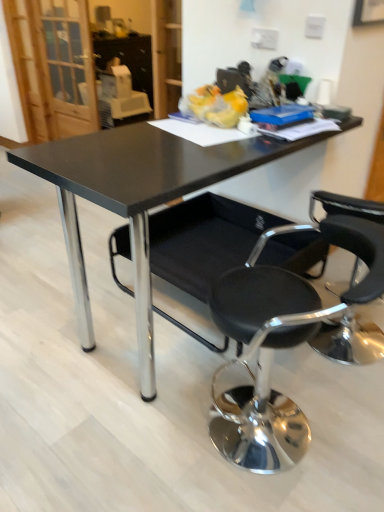
Locate an element on the screen. Image resolution: width=384 pixels, height=512 pixels. black glossy table at center is located at coordinates (135, 199).

Measure the distance between black fabric chair at center, the second chair viewed from the front, and camera.

A distance of 1.95 meters exists between black fabric chair at center, the second chair viewed from the front, and camera.

The height and width of the screenshot is (512, 384). What do you see at coordinates (204, 240) in the screenshot?
I see `black fabric chair at center, the second chair viewed from the front` at bounding box center [204, 240].

What is the approximate width of black leather chair at lower right, which is the first chair from front to back?

The width of black leather chair at lower right, which is the first chair from front to back, is 20.86 inches.

The width and height of the screenshot is (384, 512). In order to click on black glossy table at center in this screenshot , I will do `click(135, 199)`.

Is black fabric chair at center, the second chair viewed from the front, behind black glossy table at center?

Yes.

Considering the sizes of objects black fabric chair at center, which is counted as the 1th chair, starting from the back, and black glossy table at center in the image provided, who is shorter, black fabric chair at center, which is counted as the 1th chair, starting from the back, or black glossy table at center?

With less height is black fabric chair at center, which is counted as the 1th chair, starting from the back.

Is black fabric chair at center, which is counted as the 1th chair, starting from the back, directly adjacent to black glossy table at center?

No, black fabric chair at center, which is counted as the 1th chair, starting from the back, is not with black glossy table at center.

Could you tell me if black leather chair at lower right, which is the first chair from front to back, is facing black glossy table at center?

Yes, black leather chair at lower right, which is the first chair from front to back, is oriented towards black glossy table at center.

How many degrees apart are the facing directions of black leather chair at lower right, which is counted as the 2th chair, starting from the back, and black glossy table at center?

The angular difference between black leather chair at lower right, which is counted as the 2th chair, starting from the back, and black glossy table at center is 33.2 degrees.

From a real-world perspective, between black leather chair at lower right, which is counted as the 2th chair, starting from the back, and black glossy table at center, who is vertically higher?

In real-world perspective, black glossy table at center is above.

Is point (245, 308) positioned before point (46, 150)?

No, (245, 308) is further to viewer.

Is black leather chair at lower right, which is counted as the 2th chair, starting from the back, aimed at black fabric chair at center, which is counted as the 1th chair, starting from the back?

No, black leather chair at lower right, which is counted as the 2th chair, starting from the back, is not aimed at black fabric chair at center, which is counted as the 1th chair, starting from the back.

Which of these two, black leather chair at lower right, which is counted as the 2th chair, starting from the back, or black fabric chair at center, the second chair viewed from the front, is bigger?

black fabric chair at center, the second chair viewed from the front, is bigger.

Is black leather chair at lower right, which is the first chair from front to back, inside the boundaries of black fabric chair at center, which is counted as the 1th chair, starting from the back, or outside?

black leather chair at lower right, which is the first chair from front to back, exists outside the volume of black fabric chair at center, which is counted as the 1th chair, starting from the back.

Does black leather chair at lower right, which is the first chair from front to back, appear on the left side of black fabric chair at center, which is counted as the 1th chair, starting from the back?

In fact, black leather chair at lower right, which is the first chair from front to back, is to the right of black fabric chair at center, which is counted as the 1th chair, starting from the back.

How many degrees apart are the facing directions of black glossy table at center and black fabric chair at center, the second chair viewed from the front?

The angular difference between black glossy table at center and black fabric chair at center, the second chair viewed from the front, is 0.00056 degrees.

What are the coordinates of `table in front of the black fabric chair at center, the second chair viewed from the front` in the screenshot? It's located at (135, 199).

Based on the photo, from a real-world perspective, which is physically above, black glossy table at center or black fabric chair at center, the second chair viewed from the front?

In real-world perspective, black glossy table at center is above.

Is black glossy table at center next to black fabric chair at center, which is counted as the 1th chair, starting from the back?

They are not placed beside each other.

Is black fabric chair at center, the second chair viewed from the front, not near black leather chair at lower right, which is the first chair from front to back?

No, black fabric chair at center, the second chair viewed from the front, is in close proximity to black leather chair at lower right, which is the first chair from front to back.

Which object is closer to the camera, black fabric chair at center, which is counted as the 1th chair, starting from the back, or black leather chair at lower right, which is counted as the 2th chair, starting from the back?

black leather chair at lower right, which is counted as the 2th chair, starting from the back, is closer to the camera.

Identify the location of chair in front of the black fabric chair at center, which is counted as the 1th chair, starting from the back. The width and height of the screenshot is (384, 512). (288, 345).

From the image's perspective, relative to black leather chair at lower right, which is the first chair from front to back, is black fabric chair at center, which is counted as the 1th chair, starting from the back, above or below?

black fabric chair at center, which is counted as the 1th chair, starting from the back, is situated higher than black leather chair at lower right, which is the first chair from front to back, in the image.

Looking at this image, from a real-world perspective, is black glossy table at center positioned over black leather chair at lower right, which is the first chair from front to back, based on gravity?

Yes.

Would you say black glossy table at center is a long distance from black leather chair at lower right, which is counted as the 2th chair, starting from the back?

No, black glossy table at center is not far away from black leather chair at lower right, which is counted as the 2th chair, starting from the back.

Does black glossy table at center have a lesser width compared to black leather chair at lower right, which is the first chair from front to back?

No, black glossy table at center is not thinner than black leather chair at lower right, which is the first chair from front to back.

Can you confirm if black glossy table at center is smaller than black leather chair at lower right, which is counted as the 2th chair, starting from the back?

No, black glossy table at center is not smaller than black leather chair at lower right, which is counted as the 2th chair, starting from the back.

This screenshot has width=384, height=512. Find the location of `table that is above the black fabric chair at center, which is counted as the 1th chair, starting from the back (from a real-world perspective)`. table that is above the black fabric chair at center, which is counted as the 1th chair, starting from the back (from a real-world perspective) is located at coordinates (135, 199).

At what (x,y) coordinates should I click in order to perform the action: click on table above the black leather chair at lower right, which is the first chair from front to back (from the image's perspective). Please return your answer as a coordinate pair (x, y). Image resolution: width=384 pixels, height=512 pixels. Looking at the image, I should click on (135, 199).

Looking at the image, which one is located closer to black leather chair at lower right, which is the first chair from front to back, black fabric chair at center, which is counted as the 1th chair, starting from the back, or black glossy table at center?

The object closer to black leather chair at lower right, which is the first chair from front to back, is black fabric chair at center, which is counted as the 1th chair, starting from the back.

Which object lies further to the anchor point black fabric chair at center, which is counted as the 1th chair, starting from the back, black glossy table at center or black leather chair at lower right, which is counted as the 2th chair, starting from the back?

black glossy table at center is positioned further to the anchor black fabric chair at center, which is counted as the 1th chair, starting from the back.

Looking at the image, which one is located closer to black fabric chair at center, the second chair viewed from the front, black leather chair at lower right, which is the first chair from front to back, or black glossy table at center?

black leather chair at lower right, which is the first chair from front to back, is positioned closer to the anchor black fabric chair at center, the second chair viewed from the front.

Estimate the real-world distances between objects in this image. Which object is closer to black glossy table at center, black leather chair at lower right, which is counted as the 2th chair, starting from the back, or black fabric chair at center, the second chair viewed from the front?

black fabric chair at center, the second chair viewed from the front, is closer to black glossy table at center.

When comparing their distances from black glossy table at center, does black fabric chair at center, which is counted as the 1th chair, starting from the back, or black leather chair at lower right, which is counted as the 2th chair, starting from the back, seem further?

black leather chair at lower right, which is counted as the 2th chair, starting from the back, lies further to black glossy table at center than the other object.

Based on their spatial positions, is black glossy table at center or black fabric chair at center, which is counted as the 1th chair, starting from the back, further from black leather chair at lower right, which is counted as the 2th chair, starting from the back?

The object further to black leather chair at lower right, which is counted as the 2th chair, starting from the back, is black glossy table at center.

Identify the location of table between black leather chair at lower right, which is counted as the 2th chair, starting from the back, and black fabric chair at center, which is counted as the 1th chair, starting from the back, in the front-back direction. The height and width of the screenshot is (512, 384). (135, 199).